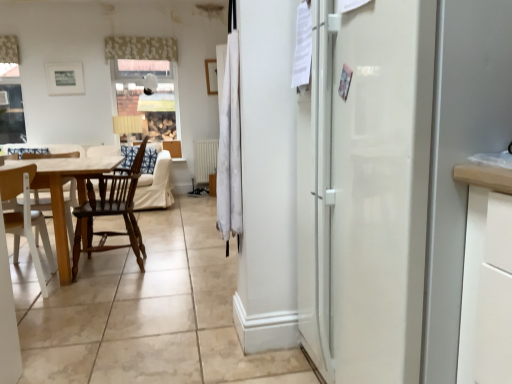
The width and height of the screenshot is (512, 384). In order to click on unoccupied region to the right of dark brown wood chair at left, arranged as the 1th chair when viewed from the right in this screenshot , I will do `click(183, 267)`.